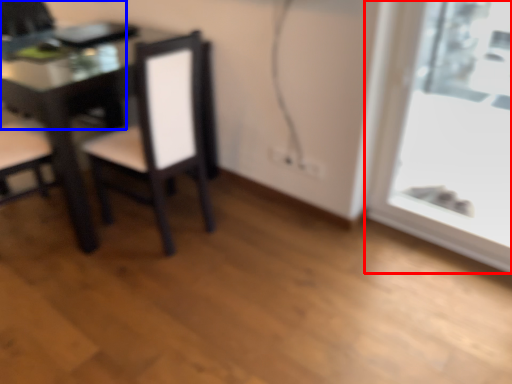
Question: Which object is closer to the camera taking this photo, window (highlighted by a red box) or chair (highlighted by a blue box)?

Choices:
 (A) window
 (B) chair

Answer: (A)